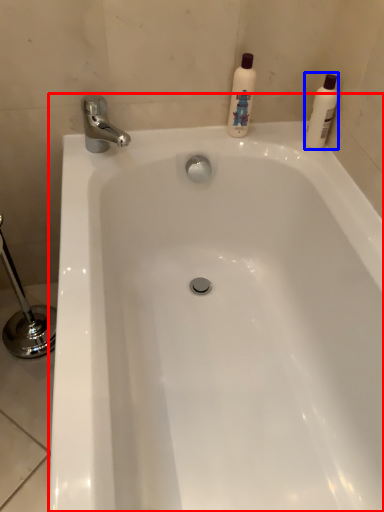
Question: Among these objects, which one is farthest to the camera, bathtub (highlighted by a red box) or cleaning product (highlighted by a blue box)?

Choices:
 (A) bathtub
 (B) cleaning product

Answer: (B)